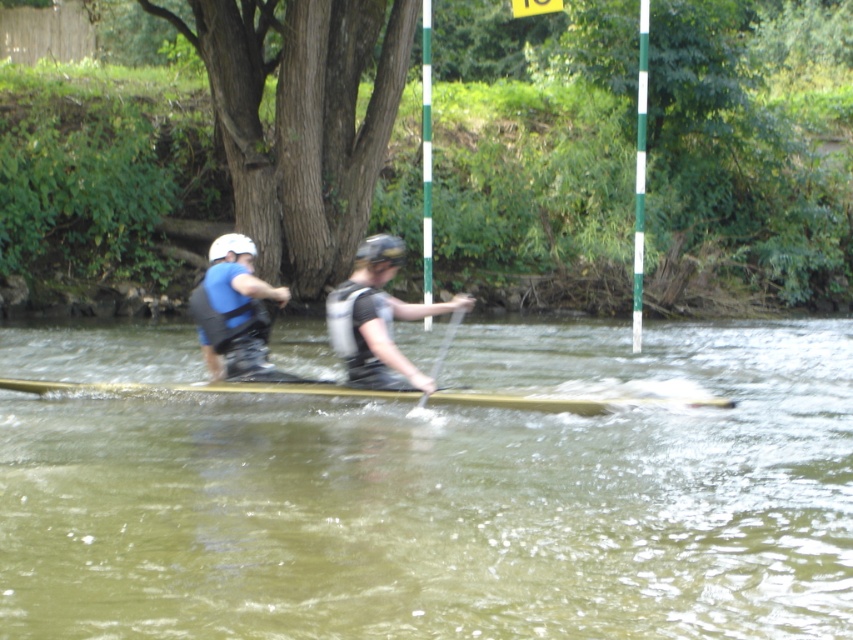
You are a drone operator trying to capture aerial footage of the canoeists. You need to position your drone between the two points, point (811, 595) and point (442, 355), to get the best shot. Which point should the drone be closer to in order to stay ahead of the canoeists as they move forward?

The drone should be closer to point (811, 595) because it is in front of point (442, 355), so staying near that point will keep the drone ahead of the canoeists as they move forward.

You are a photographer trying to capture a clear photo of the wooden canoe at center and the smooth wood paddle at center. Since you want to focus on the canoe, which object should you zoom in on more to ensure it takes up more of the frame?

The wooden canoe at center occupies less space than the smooth wood paddle at center, so you should zoom in on the wooden canoe at center to make it larger in the frame.

You are standing on the riverbank and see the wooden canoe at center. Can you estimate how far the wooden canoe at center is from the point marked at coordinates (204, 388)?

The wooden canoe at center is exactly at the point marked at coordinates (204, 388), so the distance is zero.